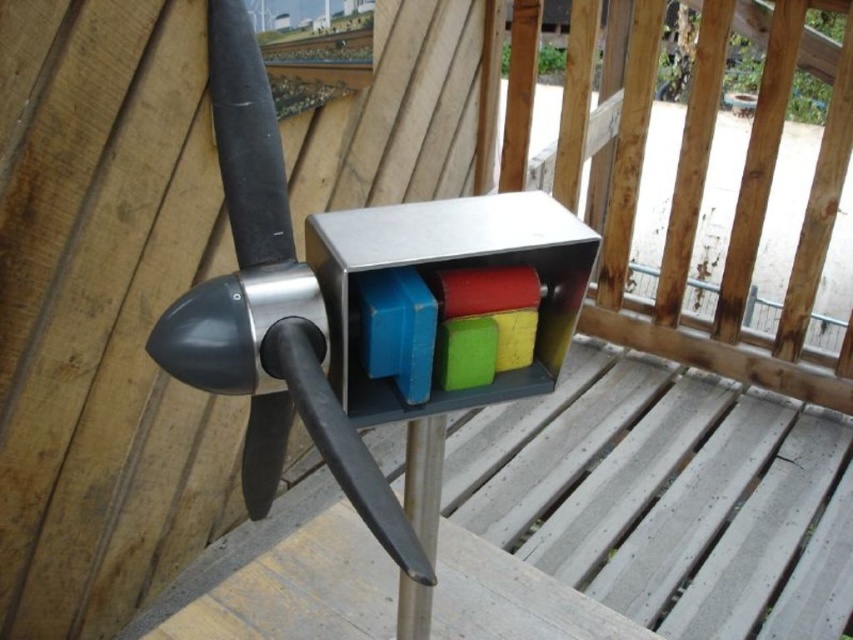
You are an artist who wants to place a new sculpture between the metallic gray propeller at center and the polished metal propeller at center. Which propeller should you position the sculpture closer to if you want it to be closer to the lower one?

The metallic gray propeller at center is below the polished metal propeller at center, so positioning the sculpture closer to the metallic gray propeller at center would place it nearer to the lower one.

You are an artist planning to install a new sculpture next to the metallic gray propeller at center and the polished metal propeller at center. Which propeller should you place your sculpture closer to if you want it to be more noticeable against the background? Explain your reasoning based on their sizes.

The metallic gray propeller at center is much taller than the polished metal propeller at center. Therefore, placing the sculpture closer to the taller metallic gray propeller at center would make it more noticeable against the background due to its greater height.

You are standing at the origin point of the coordinate system in the image. Where is the polished metal propeller at center located in terms of its 2D coordinates?

The polished metal propeller at center is located at the 2D coordinates of point (270, 308).